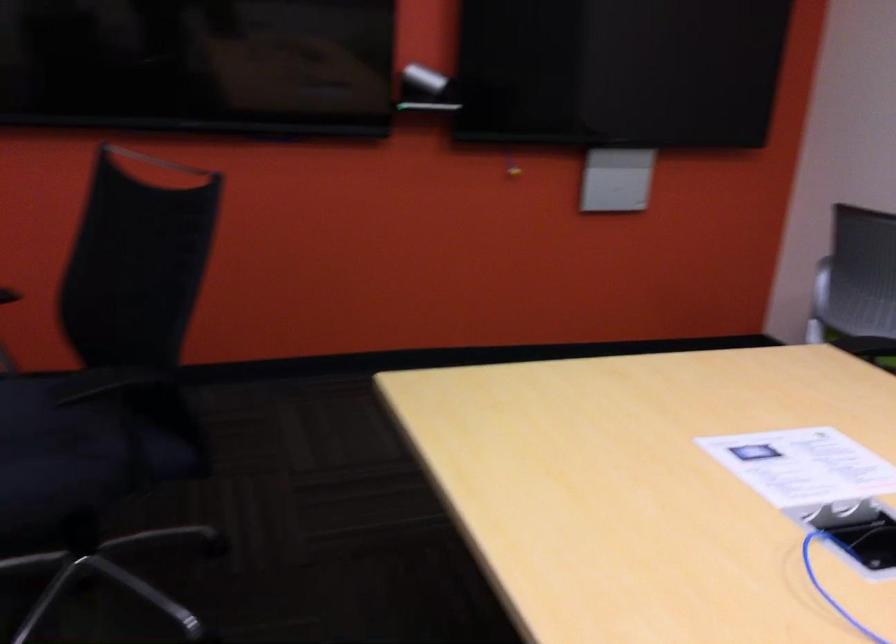
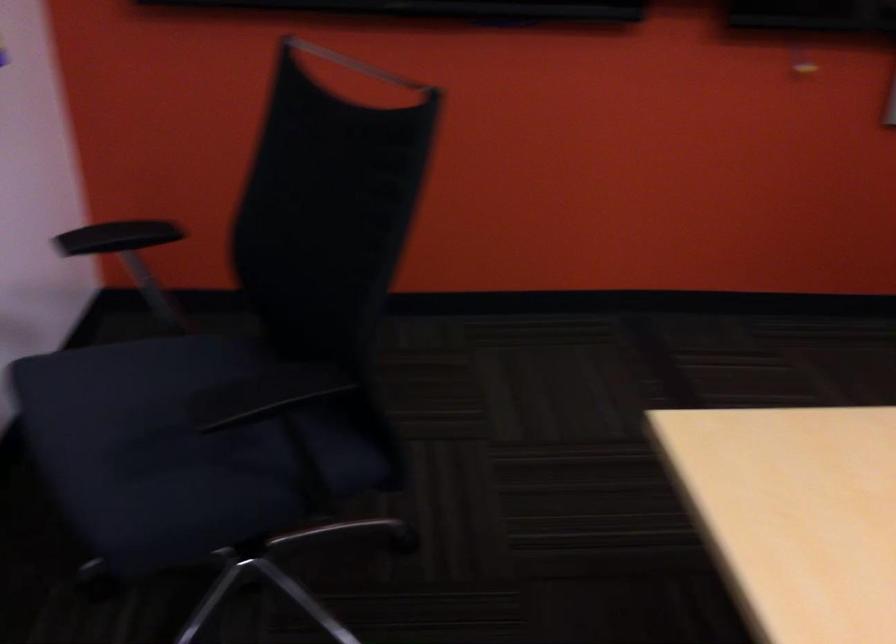
Locate, in the second image, the point that corresponds to point (108, 379) in the first image.

(264, 395)